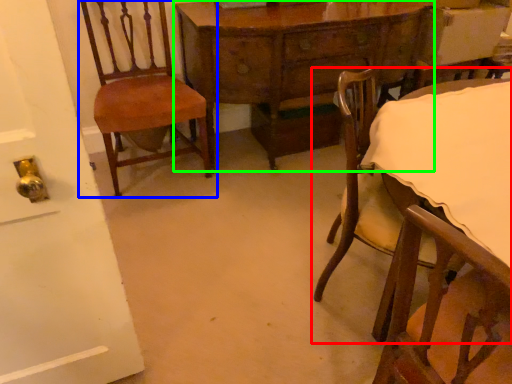
Question: Which is nearer to the chair (highlighted by a red box)? chair (highlighted by a blue box) or table (highlighted by a green box).

Choices:
 (A) chair
 (B) table

Answer: (B)